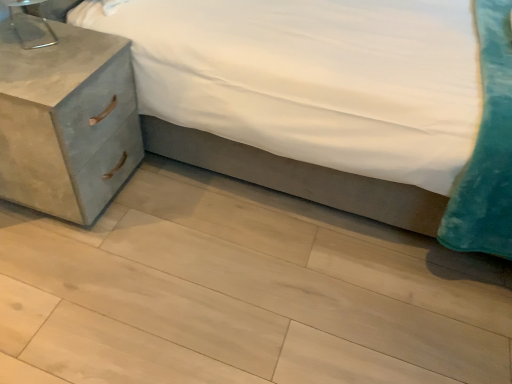
Find the location of a particular element. free location to the right of matte concrete nightstand at left is located at coordinates (160, 217).